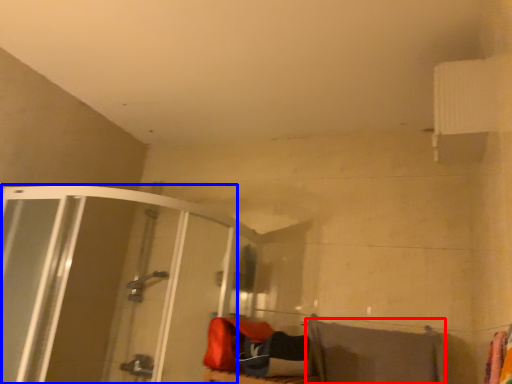
Question: Which point is further to the camera, beach towel (highlighted by a red box) or shower door (highlighted by a blue box)?

Choices:
 (A) beach towel
 (B) shower door

Answer: (A)